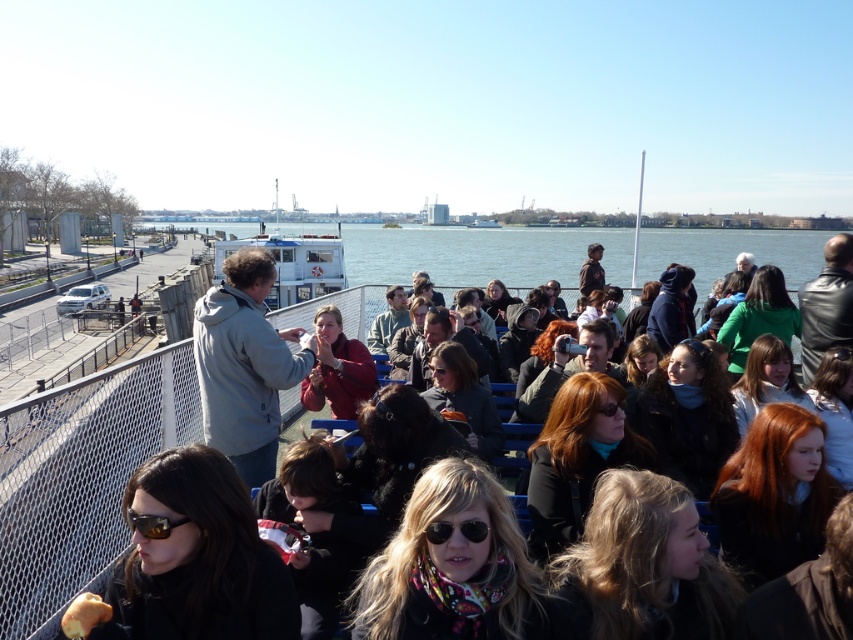
Question: Based on their relative distances, which object is farther from the matte black sunglasses at center?

Choices:
 (A) gray matte jacket at upper left
 (B) matte brown goggles at lower center

Answer: (B)

Question: Can you confirm if gray fleece jacket at center is positioned to the right of white plastic ferry at center?

Choices:
 (A) no
 (B) yes

Answer: (B)

Question: Is white plastic ferry at center to the left of sunglasses at center from the viewer's perspective?

Choices:
 (A) yes
 (B) no

Answer: (A)

Question: Does matte black sunglasses at lower left appear on the left side of white plastic ferry at center?

Choices:
 (A) yes
 (B) no

Answer: (B)

Question: Among these objects, which one is nearest to the camera?

Choices:
 (A) golden brown bread at lower left
 (B) matte black sunglasses at lower left
 (C) white plastic ferry at center

Answer: (A)

Question: Which object is closer to the camera taking this photo?

Choices:
 (A) gray matte jacket at upper left
 (B) matte black sunglasses at lower left

Answer: (B)